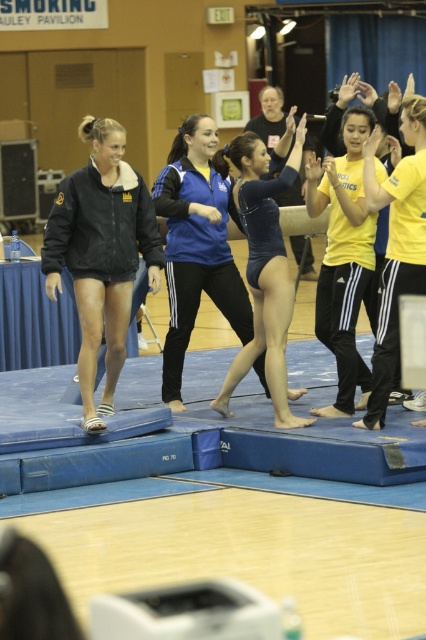
Consider the image. Is yellow matte athletic top at right taller than blue leotard at center?

Correct, yellow matte athletic top at right is much taller as blue leotard at center.

From the picture: Is yellow matte athletic top at right positioned at the back of blue leotard at center?

Yes, it is behind blue leotard at center.

Does point (353, 346) come in front of point (264, 244)?

No.

Locate an element on the screen. The height and width of the screenshot is (640, 426). yellow matte athletic top at right is located at coordinates (344, 257).

What do you see at coordinates (101, 253) in the screenshot? I see `black fleece jacket at left` at bounding box center [101, 253].

How far apart are black fleece jacket at left and yellow matte athletic top at right?

black fleece jacket at left and yellow matte athletic top at right are 2.85 meters apart from each other.

Locate an element on the screen. The width and height of the screenshot is (426, 640). black fleece jacket at left is located at coordinates (101, 253).

Can you confirm if black fleece jacket at left is positioned to the right of blue leotard at center?

No, black fleece jacket at left is not to the right of blue leotard at center.

Based on the photo, can you confirm if black fleece jacket at left is bigger than blue leotard at center?

Incorrect, black fleece jacket at left is not larger than blue leotard at center.

The width and height of the screenshot is (426, 640). What do you see at coordinates (101, 253) in the screenshot? I see `black fleece jacket at left` at bounding box center [101, 253].

The width and height of the screenshot is (426, 640). Identify the location of black fleece jacket at left. (101, 253).